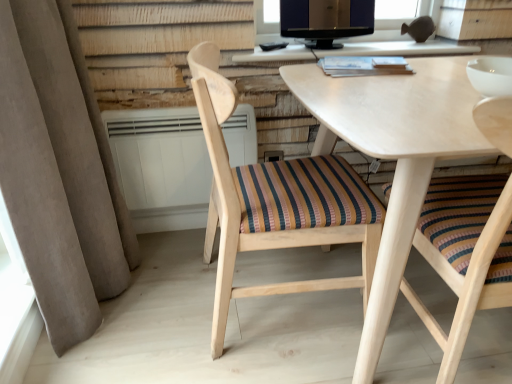
Identify the location of free space between wooden chair with striped cushion at center, positioned as the first chair in left-to-right order, and beige fabric curtain at left. (163, 295).